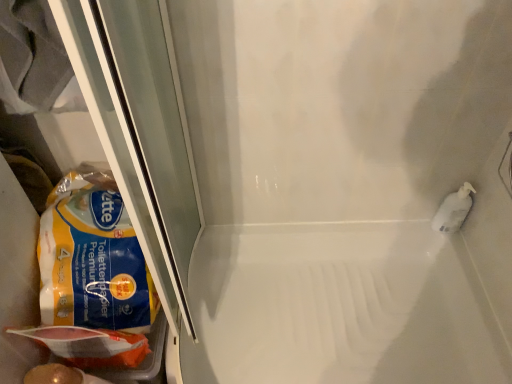
Question: Is yellow matte paper towel at left positioned in front of matte plastic bag at lower left?

Choices:
 (A) yes
 (B) no

Answer: (B)

Question: Can you confirm if yellow matte paper towel at left is bigger than matte plastic bag at lower left?

Choices:
 (A) no
 (B) yes

Answer: (B)

Question: Can you confirm if yellow matte paper towel at left is thinner than matte plastic bag at lower left?

Choices:
 (A) no
 (B) yes

Answer: (A)

Question: Is yellow matte paper towel at left at the left side of matte plastic bag at lower left?

Choices:
 (A) yes
 (B) no

Answer: (B)

Question: Considering the relative sizes of yellow matte paper towel at left and matte plastic bag at lower left in the image provided, is yellow matte paper towel at left smaller than matte plastic bag at lower left?

Choices:
 (A) yes
 (B) no

Answer: (B)

Question: Visually, is matte plastic bag at lower left positioned to the left or to the right of white glossy bath at center?

Choices:
 (A) right
 (B) left

Answer: (B)

Question: From a real-world perspective, is matte plastic bag at lower left physically located above or below white glossy bath at center?

Choices:
 (A) below
 (B) above

Answer: (B)

Question: Is matte plastic bag at lower left inside the boundaries of white glossy bath at center, or outside?

Choices:
 (A) inside
 (B) outside

Answer: (B)

Question: From the image's perspective, is matte plastic bag at lower left above or below white glossy bath at center?

Choices:
 (A) below
 (B) above

Answer: (B)

Question: From the image's perspective, relative to yellow matte paper towel at left, is matte plastic bag at lower left above or below?

Choices:
 (A) above
 (B) below

Answer: (B)

Question: Is matte plastic bag at lower left in front of or behind yellow matte paper towel at left in the image?

Choices:
 (A) behind
 (B) front

Answer: (B)

Question: Is matte plastic bag at lower left inside or outside of yellow matte paper towel at left?

Choices:
 (A) outside
 (B) inside

Answer: (A)

Question: From a real-world perspective, is matte plastic bag at lower left physically located above or below yellow matte paper towel at left?

Choices:
 (A) below
 (B) above

Answer: (A)

Question: From a real-world perspective, is white glossy bath at center above or below yellow matte paper towel at left?

Choices:
 (A) above
 (B) below

Answer: (B)

Question: Looking at their shapes, would you say white glossy bath at center is wider or thinner than yellow matte paper towel at left?

Choices:
 (A) wide
 (B) thin

Answer: (A)